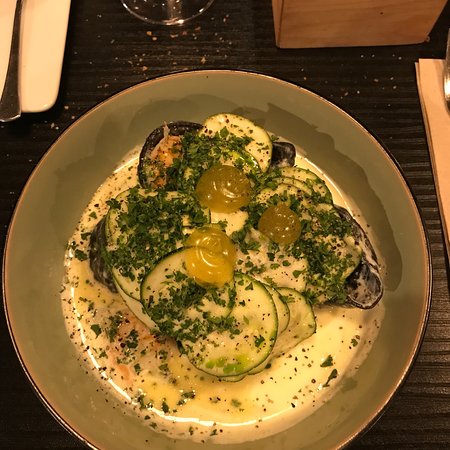
Identify the location of left edge of plate. Image resolution: width=450 pixels, height=450 pixels. (4, 281).